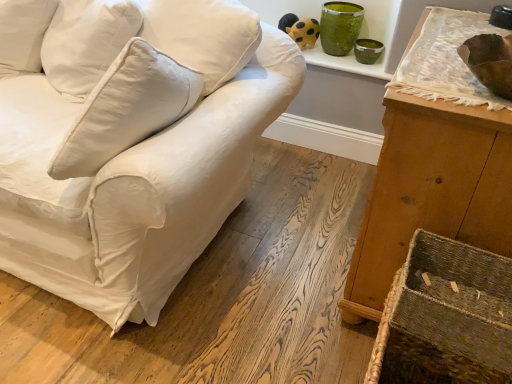
The image size is (512, 384). Describe the element at coordinates (430, 191) in the screenshot. I see `wooden cabinet at right` at that location.

At what (x,y) coordinates should I click in order to perform the action: click on white cotton couch at center. Please return your answer as a coordinate pair (x, y). Image resolution: width=512 pixels, height=384 pixels. Looking at the image, I should click on 129,141.

In order to face yellow matte plush toy at upper center, should I rotate leftwards or rightwards?

You should look right and rotate roughly 6.186 degrees.

Identify the location of wooden cabinet at right. This screenshot has height=384, width=512. (430, 191).

Which of these two, yellow matte plush toy at upper center or white cotton couch at center, stands shorter?

yellow matte plush toy at upper center is shorter.

The height and width of the screenshot is (384, 512). In the image, there is a white cotton couch at center. Find the location of `toy above it (from the image's perspective)`. toy above it (from the image's perspective) is located at coordinates (300, 30).

From the picture: Can you confirm if yellow matte plush toy at upper center is wider than white cotton couch at center?

Incorrect, the width of yellow matte plush toy at upper center does not surpass that of white cotton couch at center.

Considering the relative sizes of green glass vase at upper right and rustic woven basket at lower right in the image provided, is green glass vase at upper right smaller than rustic woven basket at lower right?

No, green glass vase at upper right is not smaller than rustic woven basket at lower right.

Is green glass vase at upper right wider than rustic woven basket at lower right?

No.

This screenshot has width=512, height=384. I want to click on crate in front of the green glass vase at upper right, so click(446, 317).

Which object is closer to the camera taking this photo, green glass vase at upper right or rustic woven basket at lower right?

Positioned in front is rustic woven basket at lower right.

Considering the positions of objects rustic woven basket at lower right and green glass vase at upper right in the image provided, who is in front, rustic woven basket at lower right or green glass vase at upper right?

rustic woven basket at lower right is closer to the camera.

Is rustic woven basket at lower right aimed at green glass vase at upper right?

No, rustic woven basket at lower right does not turn towards green glass vase at upper right.

From a real-world perspective, is rustic woven basket at lower right physically above green glass vase at upper right?

Incorrect, from a real-world perspective, rustic woven basket at lower right is lower than green glass vase at upper right.

Is white cotton couch at center turned away from green glass vase at upper right?

Yes, white cotton couch at center is positioned with its back facing green glass vase at upper right.

Consider the image. Is white cotton couch at center positioned beyond the bounds of green glass vase at upper right?

white cotton couch at center lies outside green glass vase at upper right's area.

Which of these two, white cotton couch at center or green glass vase at upper right, is thinner?

green glass vase at upper right is thinner.

Which object is further away from the camera taking this photo, white cotton couch at center or yellow matte plush toy at upper center?

yellow matte plush toy at upper center is further from the camera.

Measure the distance between white cotton couch at center and yellow matte plush toy at upper center.

A distance of 1.21 meters exists between white cotton couch at center and yellow matte plush toy at upper center.

How different are the orientations of white cotton couch at center and yellow matte plush toy at upper center in degrees?

33.7 degrees separate the facing orientations of white cotton couch at center and yellow matte plush toy at upper center.

Consider the image. From a real-world perspective, is white cotton couch at center physically located above or below yellow matte plush toy at upper center?

From a real-world perspective, white cotton couch at center is physically below yellow matte plush toy at upper center.

Can you confirm if wooden cabinet at right is wider than rustic woven basket at lower right?

Indeed, wooden cabinet at right has a greater width compared to rustic woven basket at lower right.

Does wooden cabinet at right have a greater height compared to rustic woven basket at lower right?

Indeed, wooden cabinet at right has a greater height compared to rustic woven basket at lower right.

Is wooden cabinet at right next to rustic woven basket at lower right and touching it?

wooden cabinet at right is not next to rustic woven basket at lower right, and they're not touching.

Consider the image. Is wooden cabinet at right inside or outside of rustic woven basket at lower right?

wooden cabinet at right exists outside the volume of rustic woven basket at lower right.

From the image's perspective, is white cotton couch at center over wooden cabinet at right?

Yes, from the image's perspective, white cotton couch at center is on top of wooden cabinet at right.

Is white cotton couch at center at the right side of wooden cabinet at right?

No.

Considering the sizes of objects white cotton couch at center and wooden cabinet at right in the image provided, who is wider, white cotton couch at center or wooden cabinet at right?

With larger width is white cotton couch at center.

Consider the image. Is white cotton couch at center inside or outside of wooden cabinet at right?

white cotton couch at center is outside wooden cabinet at right.

In order to click on studio couch below the yellow matte plush toy at upper center (from a real-world perspective) in this screenshot , I will do `click(129, 141)`.

This screenshot has height=384, width=512. Find the location of `crate to the right of green glass vase at upper right`. crate to the right of green glass vase at upper right is located at coordinates (446, 317).

From the image, which object appears to be nearer to rustic woven basket at lower right, wooden cabinet at right or white cotton couch at center?

wooden cabinet at right.

From the image, which object appears to be farther from wooden cabinet at right, white cotton couch at center or rustic woven basket at lower right?

The object further to wooden cabinet at right is white cotton couch at center.

Considering their positions, is wooden cabinet at right positioned further to yellow matte plush toy at upper center than green glass vase at upper right?

wooden cabinet at right is further to yellow matte plush toy at upper center.

Considering their positions, is wooden cabinet at right positioned closer to white cotton couch at center than rustic woven basket at lower right?

Among the two, wooden cabinet at right is located nearer to white cotton couch at center.

Looking at the image, which one is located closer to yellow matte plush toy at upper center, wooden cabinet at right or white cotton couch at center?

white cotton couch at center is closer to yellow matte plush toy at upper center.

When comparing their distances from yellow matte plush toy at upper center, does green glass vase at upper right or white cotton couch at center seem further?

The object further to yellow matte plush toy at upper center is white cotton couch at center.

Estimate the real-world distances between objects in this image. Which object is further from yellow matte plush toy at upper center, white cotton couch at center or rustic woven basket at lower right?

Among the two, rustic woven basket at lower right is located further to yellow matte plush toy at upper center.

When comparing their distances from green glass vase at upper right, does rustic woven basket at lower right or wooden cabinet at right seem further?

rustic woven basket at lower right is further to green glass vase at upper right.

At what (x,y) coordinates should I click in order to perform the action: click on toy between white cotton couch at center and wooden cabinet at right in the horizontal direction. Please return your answer as a coordinate pair (x, y). The width and height of the screenshot is (512, 384). Looking at the image, I should click on (300, 30).

Where is `glass vase positioned between wooden cabinet at right and yellow matte plush toy at upper center from near to far`? Image resolution: width=512 pixels, height=384 pixels. glass vase positioned between wooden cabinet at right and yellow matte plush toy at upper center from near to far is located at coordinates (340, 27).

Locate an element on the screen. The image size is (512, 384). crate between white cotton couch at center and wooden cabinet at right is located at coordinates (446, 317).

I want to click on toy situated between white cotton couch at center and rustic woven basket at lower right from left to right, so click(x=300, y=30).